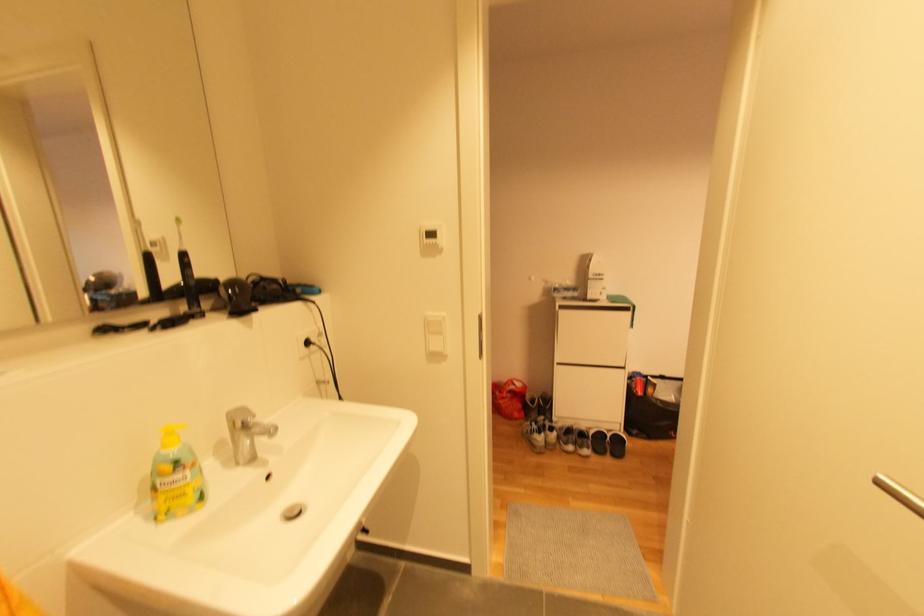
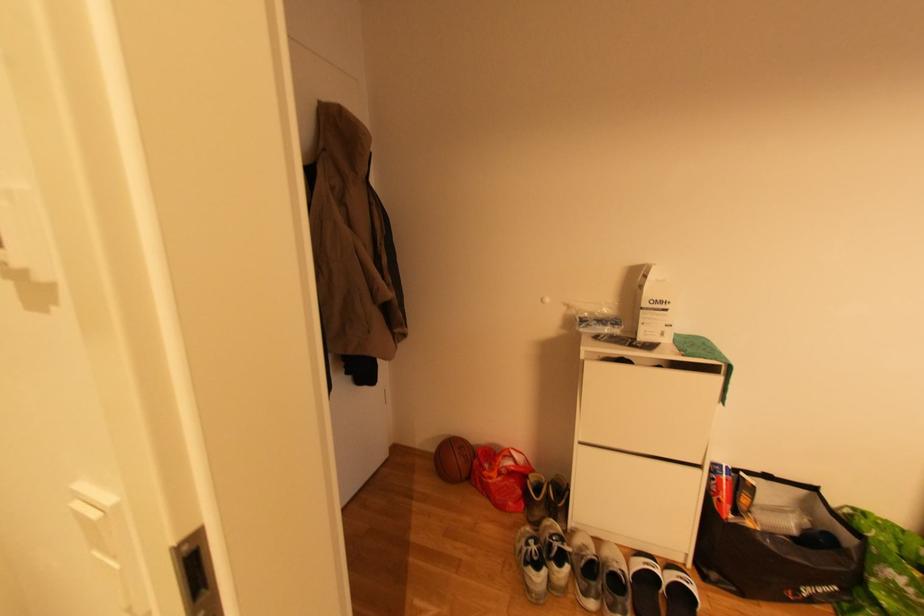
Question: Based on the continuous images, in which direction is the camera rotating? Reply with the corresponding letter.

Choices:
 (A) Left
 (B) Right
 (C) Up
 (D) Down

Answer: (A)